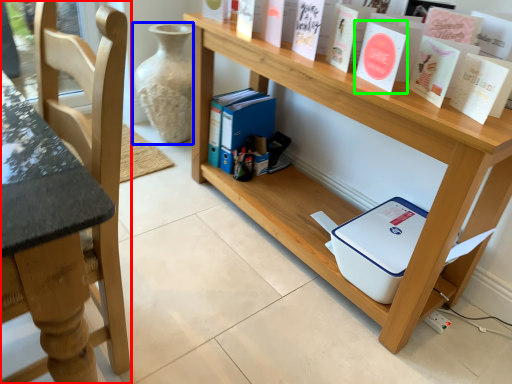
Question: Which object is positioned closest to chair (highlighted by a red box)? Select from glass vase (highlighted by a blue box) and paperback book (highlighted by a green box).

Choices:
 (A) glass vase
 (B) paperback book

Answer: (B)